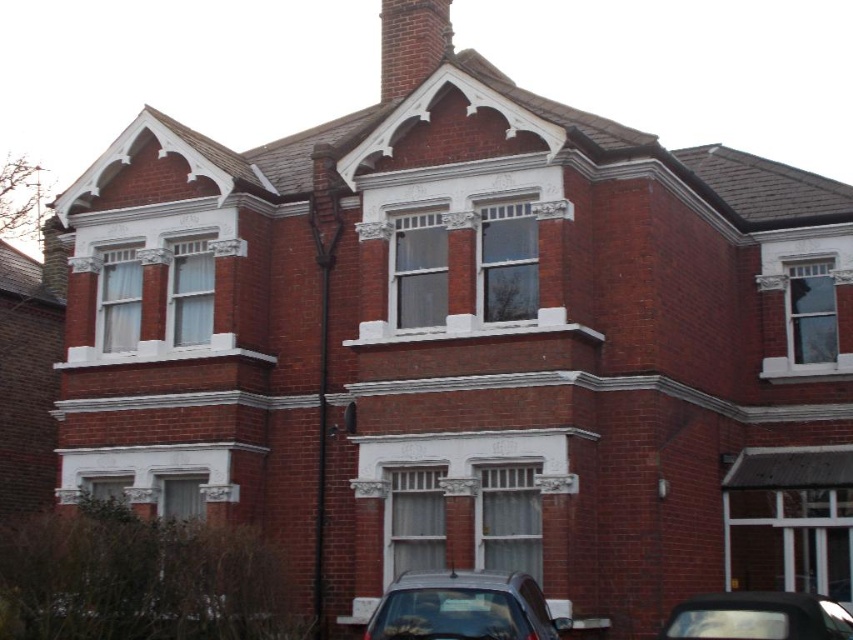
Which of these two, shiny black car at lower right or brick chimney at upper center, stands taller?

With more height is brick chimney at upper center.

Can you confirm if shiny black car at lower right is thinner than brick chimney at upper center?

Correct, shiny black car at lower right's width is less than brick chimney at upper center's.

Locate an element on the screen. shiny black car at lower right is located at coordinates (758, 618).

Identify the location of shiny black car at lower right. (758, 618).

Identify the location of shiny silver car at lower center. (463, 608).

Looking at this image, does shiny silver car at lower center have a lesser height compared to brick chimney at upper center?

Correct, shiny silver car at lower center is not as tall as brick chimney at upper center.

Does point (422, 573) come farther from viewer compared to point (430, 58)?

No.

Find the location of `shiny silver car at lower center`. shiny silver car at lower center is located at coordinates (463, 608).

Who is more distant from viewer, [485,628] or [758,595]?

Positioned behind is point [758,595].

Where is `shiny silver car at lower center`? The width and height of the screenshot is (853, 640). shiny silver car at lower center is located at coordinates (463, 608).

What are the coordinates of `shiny silver car at lower center` in the screenshot? It's located at (463, 608).